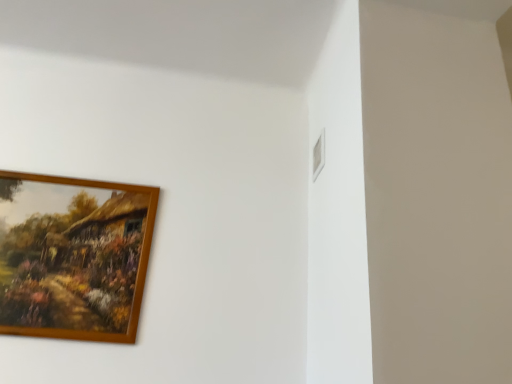
What do you see at coordinates (73, 256) in the screenshot?
I see `wooden picture frame at upper left` at bounding box center [73, 256].

Find the location of a particular element. wooden picture frame at upper left is located at coordinates (73, 256).

What are the coordinates of `wooden picture frame at upper left` in the screenshot? It's located at (73, 256).